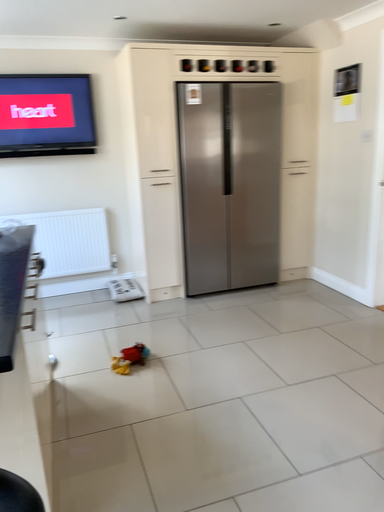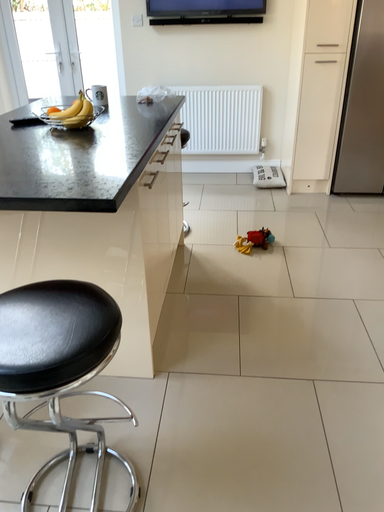
Question: Which way did the camera rotate in the video?

Choices:
 (A) rotated downward
 (B) rotated upward

Answer: (A)